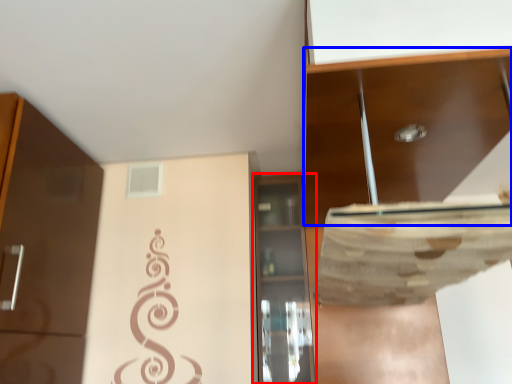
Question: Among these objects, which one is farthest to the camera, cabinetry (highlighted by a red box) or cabinetry (highlighted by a blue box)?

Choices:
 (A) cabinetry
 (B) cabinetry

Answer: (A)